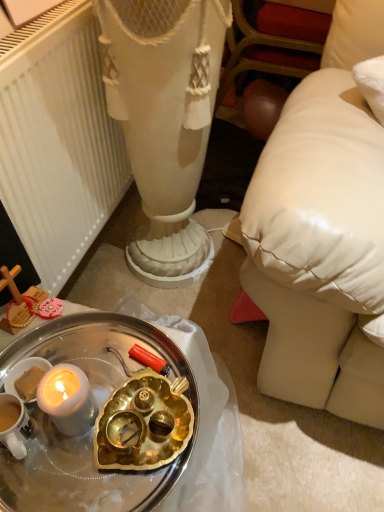
Describe the element at coordinates (91, 429) in the screenshot. The height and width of the screenshot is (512, 384). I see `white metallic tray at lower left` at that location.

Measure the distance between white metallic tray at lower left and camera.

They are 22.89 inches apart.

Where is `white metallic tray at lower left`? The image size is (384, 512). white metallic tray at lower left is located at coordinates (91, 429).

This screenshot has height=512, width=384. What do you see at coordinates (58, 140) in the screenshot? I see `white matte radiator at left` at bounding box center [58, 140].

Where is `white matte radiator at left`? The image size is (384, 512). white matte radiator at left is located at coordinates (58, 140).

Find the location of a particular element. The image size is (384, 512). white metallic tray at lower left is located at coordinates (91, 429).

Considering the relative positions of white matte radiator at left and white metallic tray at lower left in the image provided, is white matte radiator at left to the right of white metallic tray at lower left from the viewer's perspective?

In fact, white matte radiator at left is to the left of white metallic tray at lower left.

Considering their positions, is white matte radiator at left located in front of or behind white metallic tray at lower left?

Clearly, white matte radiator at left is behind white metallic tray at lower left.

Does point (64, 256) come in front of point (65, 445)?

No, (64, 256) is behind (65, 445).

From the image's perspective, is white matte radiator at left over white metallic tray at lower left?

Yes.

From a real-world perspective, who is located lower, white matte radiator at left or white metallic tray at lower left?

From a 3D spatial view, white matte radiator at left is below.

Which of these two, white matte radiator at left or white metallic tray at lower left, is thinner?

Thinner between the two is white matte radiator at left.

Can you confirm if white matte radiator at left is shorter than white metallic tray at lower left?

In fact, white matte radiator at left may be taller than white metallic tray at lower left.

Between white matte radiator at left and white metallic tray at lower left, which one has larger size?

white matte radiator at left.

Could white metallic tray at lower left be considered to be inside white matte radiator at left?

No, white metallic tray at lower left is not surrounded by white matte radiator at left.

Is white matte radiator at left far from white metallic tray at lower left?

They are positioned close to each other.

Is white matte radiator at left aimed at white metallic tray at lower left?

No.

Locate an element on the screen. The width and height of the screenshot is (384, 512). desk below the white matte radiator at left (from the image's perspective) is located at coordinates (91, 429).

Considering the positions of objects white metallic tray at lower left and white matte radiator at left in the image provided, who is more to the left, white metallic tray at lower left or white matte radiator at left?

white matte radiator at left is more to the left.

Does white metallic tray at lower left lie behind white matte radiator at left?

No, the depth of white metallic tray at lower left is less than that of white matte radiator at left.

Does point (75, 470) come behind point (90, 66)?

No, (75, 470) is closer to viewer.

From the image's perspective, would you say white metallic tray at lower left is positioned over white matte radiator at left?

No, from the image's perspective, white metallic tray at lower left is not over white matte radiator at left.

From a real-world perspective, is white metallic tray at lower left positioned above or below white matte radiator at left?

From a real-world perspective, white metallic tray at lower left is physically above white matte radiator at left.

Is white metallic tray at lower left thinner than white matte radiator at left?

In fact, white metallic tray at lower left might be wider than white matte radiator at left.

Is white metallic tray at lower left shorter than white matte radiator at left?

Indeed, white metallic tray at lower left has a lesser height compared to white matte radiator at left.

Can you confirm if white metallic tray at lower left is smaller than white matte radiator at left?

Yes, white metallic tray at lower left is smaller than white matte radiator at left.

Could white matte radiator at left be considered to be inside white metallic tray at lower left?

No, white matte radiator at left is not a part of white metallic tray at lower left.

Can you see white metallic tray at lower left touching white matte radiator at left?

They are not placed beside each other.

Is white metallic tray at lower left facing towards white matte radiator at left?

No, white metallic tray at lower left is not facing towards white matte radiator at left.

How different are the orientations of white metallic tray at lower left and white matte radiator at left in degrees?

They differ by 0.582 degrees in their facing directions.

Measure the distance from white metallic tray at lower left to white matte radiator at left.

A distance of 17.88 inches exists between white metallic tray at lower left and white matte radiator at left.

Identify the location of desk below the white matte radiator at left (from the image's perspective). (91, 429).

This screenshot has width=384, height=512. Identify the location of radiator on the left of the white metallic tray at lower left. (58, 140).

I want to click on desk located in front of the white matte radiator at left, so [x=91, y=429].